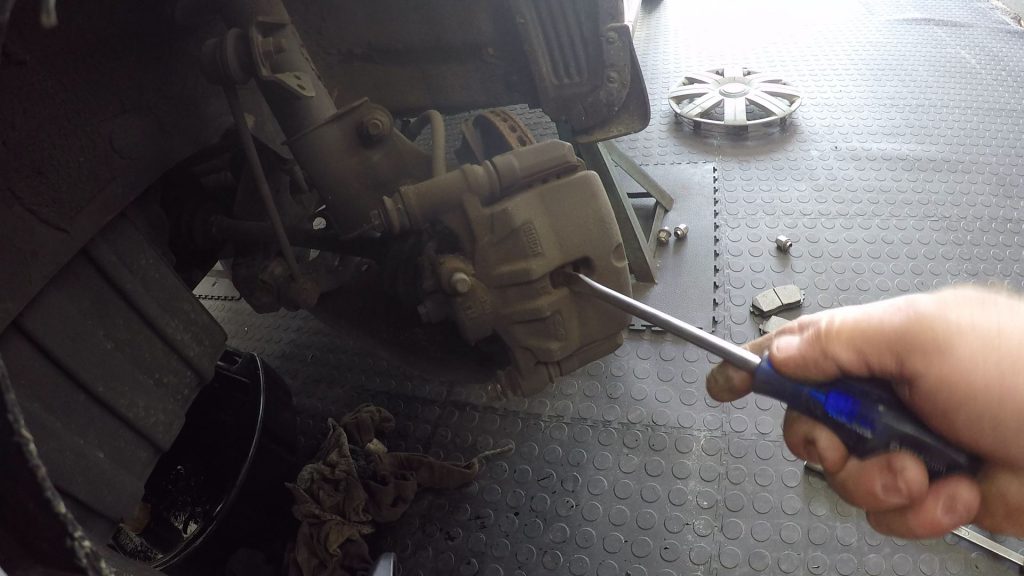
At what (x,y) coordinates should I click in order to perform the action: click on bubbles under the flooring. Please return your answer as a coordinate pair (x, y). This screenshot has height=576, width=1024. Looking at the image, I should click on (893, 153), (932, 17).